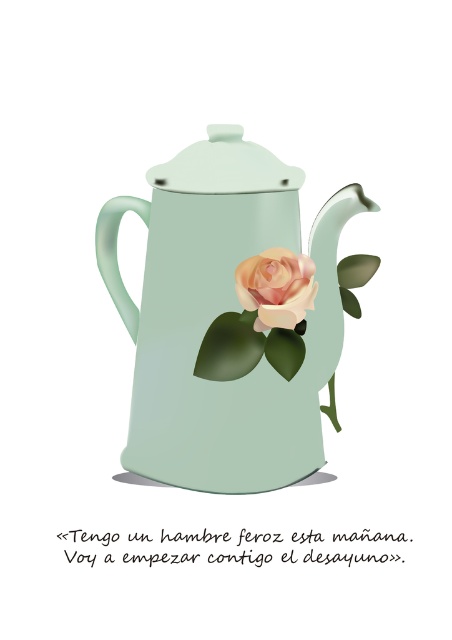
Is point (277, 454) positioned in front of point (160, 166)?

Yes, point (277, 454) is in front of point (160, 166).

Is matte ceramic teapot at center to the right of matte green lid at upper center from the viewer's perspective?

Correct, you'll find matte ceramic teapot at center to the right of matte green lid at upper center.

Where is `matte ceramic teapot at center`? Image resolution: width=452 pixels, height=640 pixels. matte ceramic teapot at center is located at coordinates (229, 317).

At what (x,y) coordinates should I click in order to perform the action: click on matte ceramic teapot at center. Please return your answer as a coordinate pair (x, y). Image resolution: width=452 pixels, height=640 pixels. Looking at the image, I should click on (229, 317).

Which is behind, point (207, 371) or point (243, 301)?

Point (207, 371)

Does matte ceramic teapot at center lie behind peach glossy rose at center?

Yes, matte ceramic teapot at center is further from the viewer.

Is point (220, 132) positioned after point (287, 317)?

That is True.

This screenshot has height=640, width=452. In order to click on matte ceramic teapot at center in this screenshot , I will do `click(229, 317)`.

Is point (191, 177) positioned in front of point (277, 308)?

That is False.

Measure the distance between matte green lid at upper center and peach glossy rose at center.

A distance of 2.06 inches exists between matte green lid at upper center and peach glossy rose at center.

Locate an element on the screen. The image size is (452, 640). matte green lid at upper center is located at coordinates (225, 166).

Identify the location of matte green lid at upper center. (225, 166).